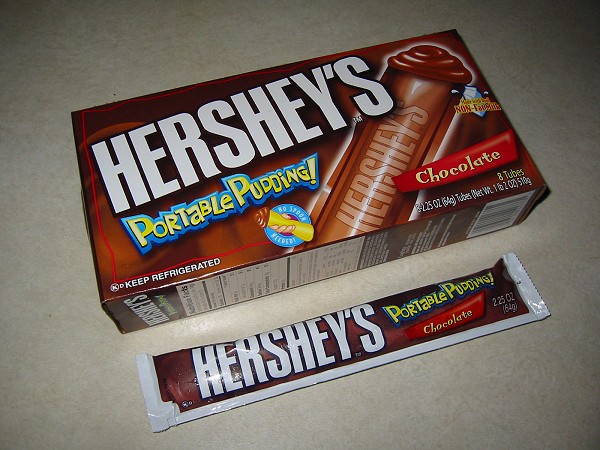
This screenshot has width=600, height=450. What are the coordinates of `box` in the screenshot? It's located at (114, 114).